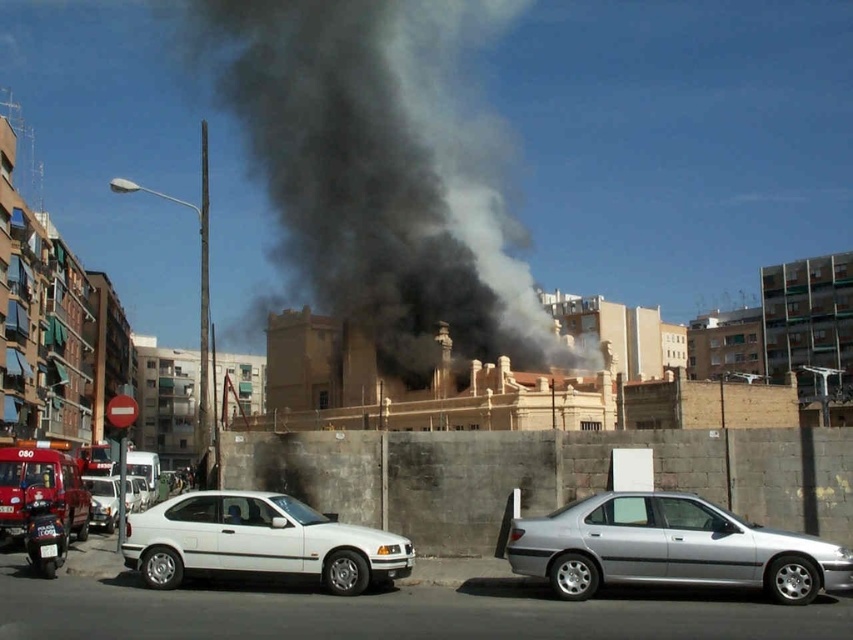
Question: Which of the following is the farthest from the observer?

Choices:
 (A) (51, 502)
 (B) (671, 509)
 (C) (225, 518)
 (D) (426, 38)

Answer: (D)

Question: Estimate the real-world distances between objects in this image. Which object is closer to the silver metallic sedan at right?

Choices:
 (A) black smoke at center
 (B) white matte van at left

Answer: (B)

Question: From the image, what is the correct spatial relationship of shiny red fire truck at lower left in relation to white matte van at left?

Choices:
 (A) above
 (B) below

Answer: (B)

Question: Is silver metallic sedan at right smaller than shiny red fire truck at lower left?

Choices:
 (A) no
 (B) yes

Answer: (B)

Question: Which point is farther from the camera taking this photo?

Choices:
 (A) pyautogui.click(x=62, y=522)
 (B) pyautogui.click(x=111, y=520)
 (C) pyautogui.click(x=293, y=506)
 (D) pyautogui.click(x=677, y=557)

Answer: (B)

Question: Can you confirm if silver metallic sedan at right is positioned below white matte van at left?

Choices:
 (A) no
 (B) yes

Answer: (A)